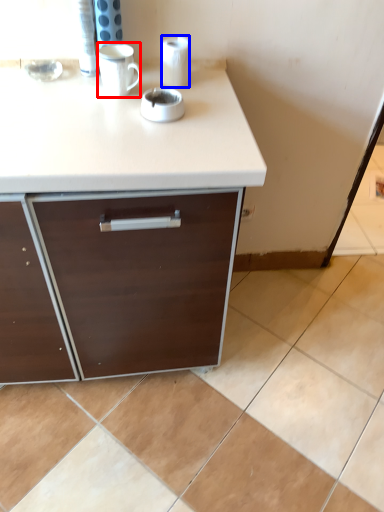
Question: Which object is closer to the camera taking this photo, mug (highlighted by a red box) or paper towel (highlighted by a blue box)?

Choices:
 (A) mug
 (B) paper towel

Answer: (A)